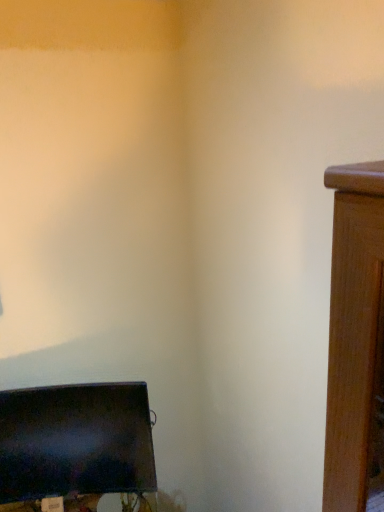
Identify the location of matte black monitor at lower left. This screenshot has height=512, width=384. (76, 448).

Describe the element at coordinates (76, 448) in the screenshot. I see `matte black monitor at lower left` at that location.

In order to face matte black monitor at lower left, should I rotate leftwards or rightwards?

You should rotate left by 15.984 degrees.

Identify the location of matte black monitor at lower left. This screenshot has height=512, width=384. (76, 448).